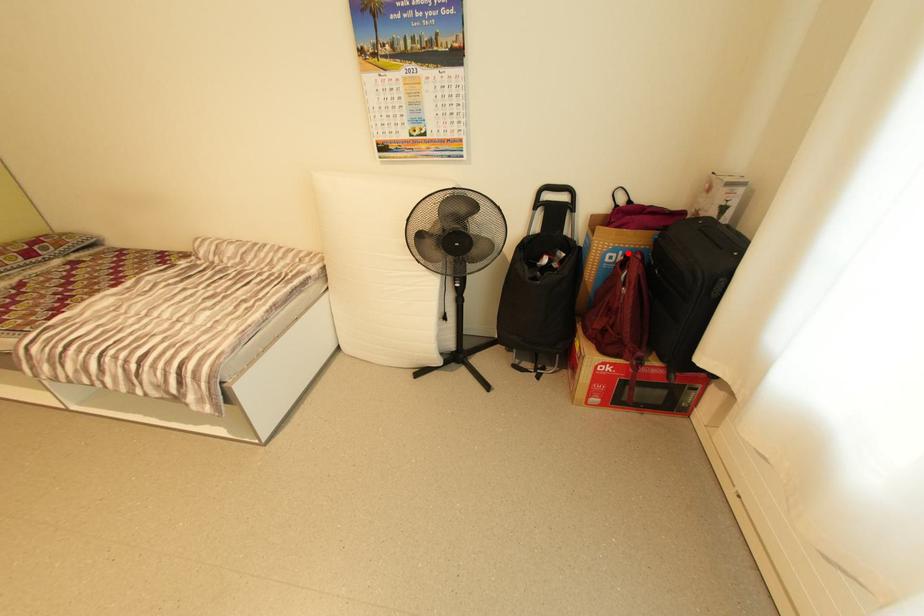
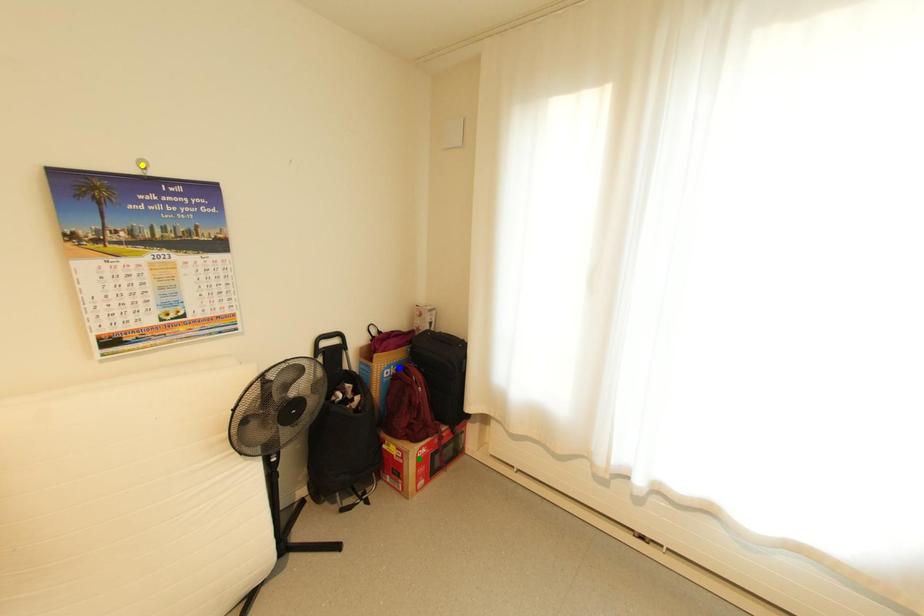
Question: I am providing you with two images of the same scene from different viewpoints. A red point is marked on the first image. You are given multiple points on the second image. Can you choose the point in image 2 that corresponds to the point in image 1?

Choices:
 (A) blue point
 (B) yellow point
 (C) green point

Answer: (A)